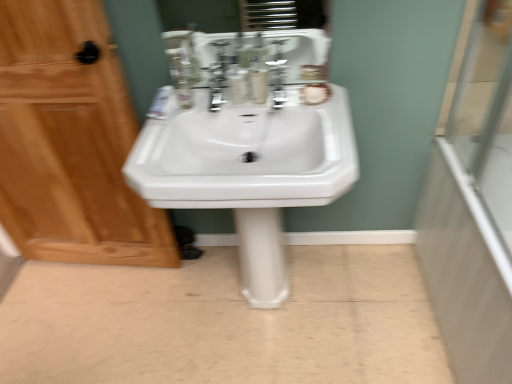
The width and height of the screenshot is (512, 384). I want to click on vacant space in white glossy sink at center (from a real-world perspective), so click(265, 308).